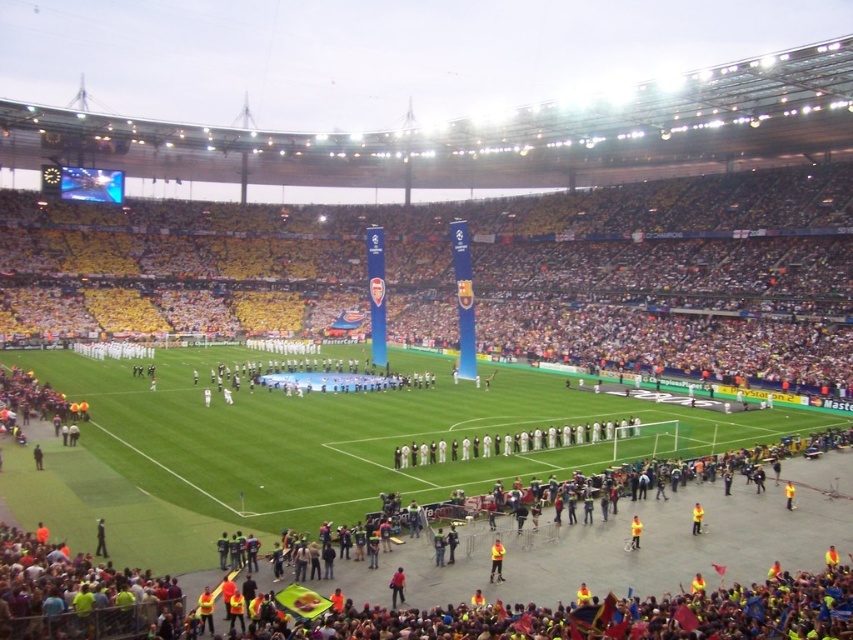
Based on the photo, can you confirm if yellow fabric at lower center is shorter than yellow reflective vest at center?

In fact, yellow fabric at lower center may be taller than yellow reflective vest at center.

Which is below, yellow fabric at lower center or yellow reflective vest at center?

yellow fabric at lower center is lower down.

This screenshot has height=640, width=853. Identify the location of yellow fabric at lower center. (496, 561).

Locate an element on the screen. yellow fabric at lower center is located at coordinates (496, 561).

Is point (503, 550) positioned before point (399, 586)?

No, (503, 550) is further to viewer.

Can you confirm if yellow fabric at lower center is wider than red fabric person at lower center?

Correct, the width of yellow fabric at lower center exceeds that of red fabric person at lower center.

Which is in front, point (498, 563) or point (401, 595)?

Point (401, 595)

Where is `yellow fabric at lower center`? This screenshot has width=853, height=640. yellow fabric at lower center is located at coordinates (496, 561).

Is red fabric person at lower center closer to camera compared to yellow reflective vest at center?

Yes, red fabric person at lower center is in front of yellow reflective vest at center.

Which is in front, point (399, 573) or point (695, 513)?

Positioned in front is point (399, 573).

Between point (402, 580) and point (699, 515), which one is positioned in front?

Point (402, 580) is in front.

Identify the location of red fabric person at lower center. The image size is (853, 640). point(397,586).